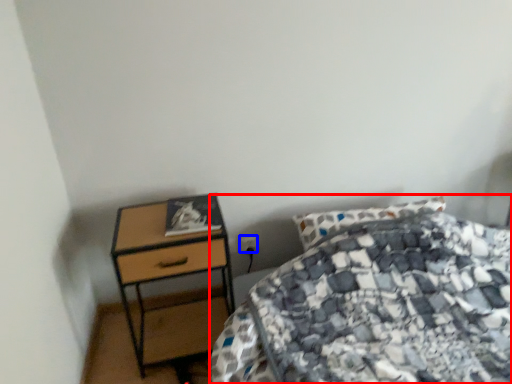
Question: Which of the following is the closest to the observer, bed (highlighted by a red box) or power plugs and sockets (highlighted by a blue box)?

Choices:
 (A) bed
 (B) power plugs and sockets

Answer: (A)